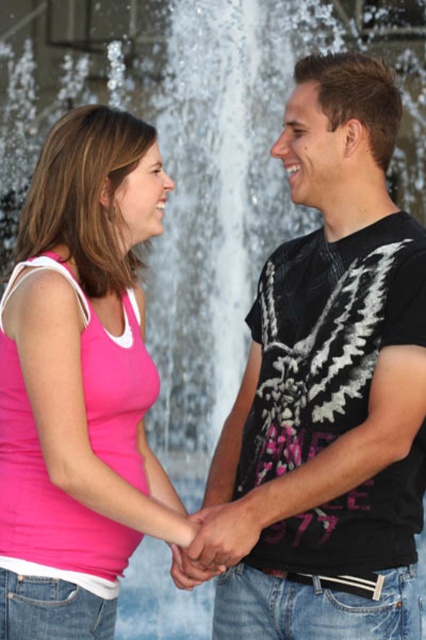
Can you confirm if black printed t-shirt at center is positioned below pink matte tank top at center?

No.

Does black printed t-shirt at center appear on the left side of pink matte tank top at center?

In fact, black printed t-shirt at center is to the right of pink matte tank top at center.

The height and width of the screenshot is (640, 426). What do you see at coordinates (327, 392) in the screenshot?
I see `black printed t-shirt at center` at bounding box center [327, 392].

Locate an element on the screen. The image size is (426, 640). black printed t-shirt at center is located at coordinates (327, 392).